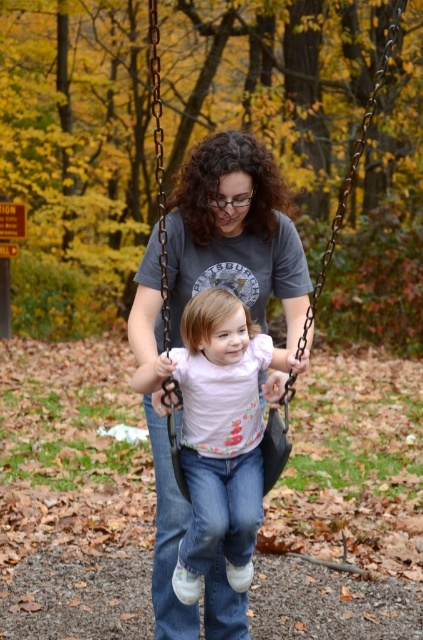
Question: From the image, what is the correct spatial relationship of gray cotton shirt at center in relation to blue denim jeans at center?

Choices:
 (A) below
 (B) above

Answer: (B)

Question: Which point appears farthest from the camera in this image?

Choices:
 (A) (233, 200)
 (B) (162, 531)
 (C) (164, 241)

Answer: (B)

Question: Observing the image, what is the correct spatial positioning of gray cotton shirt at center in reference to metallic chain swing at center?

Choices:
 (A) below
 (B) above

Answer: (A)

Question: Estimate the real-world distances between objects in this image. Which object is closer to the gray cotton shirt at center?

Choices:
 (A) blue denim jeans at center
 (B) metallic chain swing at center

Answer: (A)

Question: Can you confirm if blue denim jeans at center is positioned above metallic chain swing at center?

Choices:
 (A) yes
 (B) no

Answer: (B)

Question: Which of the following is the farthest from the observer?

Choices:
 (A) (162, 584)
 (B) (252, 308)
 (C) (376, 96)

Answer: (C)